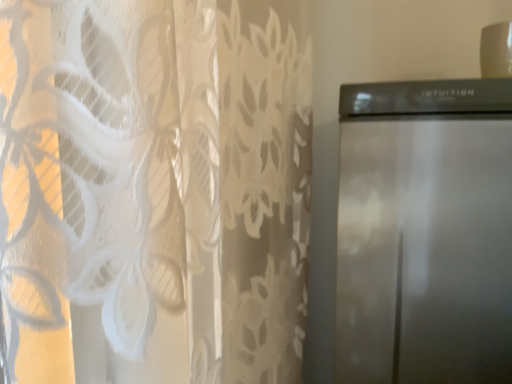
Describe the element at coordinates (425, 232) in the screenshot. I see `satin silver refrigerator at right` at that location.

Locate an element on the screen. satin silver refrigerator at right is located at coordinates (425, 232).

Looking at this image, what is the approximate height of satin silver refrigerator at right?

satin silver refrigerator at right is 34.54 inches tall.

I want to click on satin silver refrigerator at right, so click(x=425, y=232).